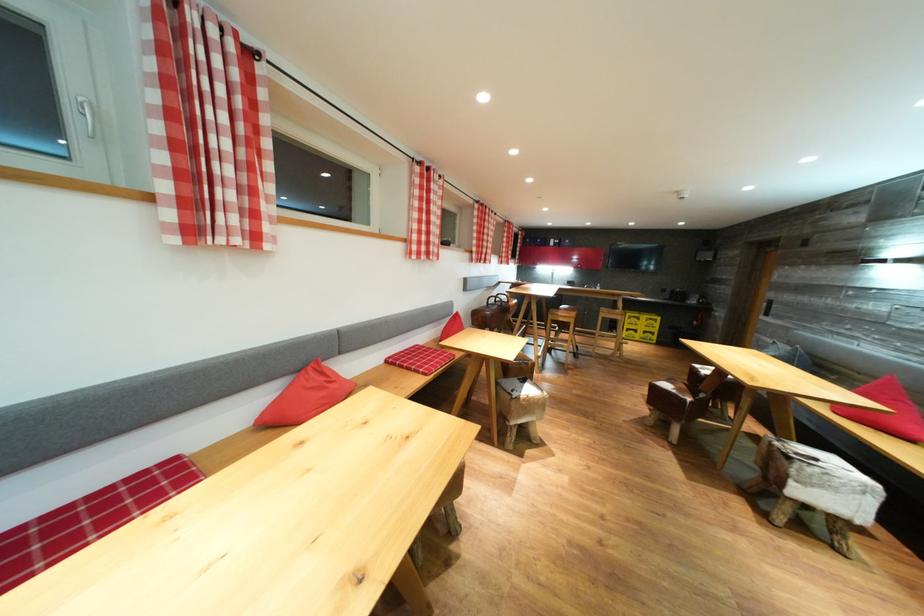
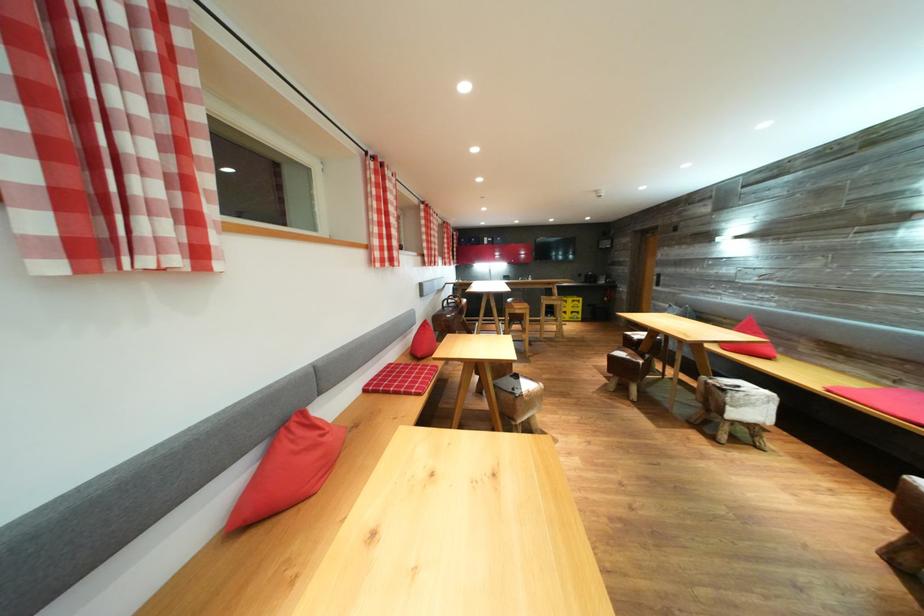
Locate, in the second image, the point that corresponds to point (821, 464) in the first image.

(745, 392)